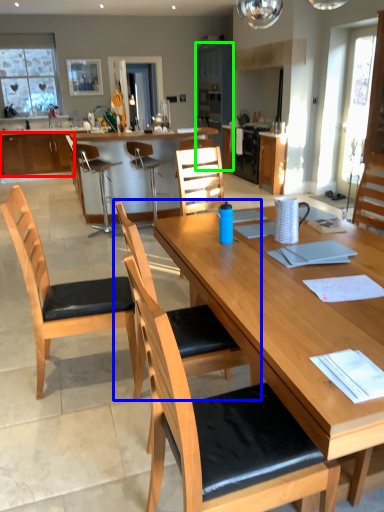
Question: Estimate the real-world distances between objects in this image. Which object is closer to cabinetry (highlighted by a red box), chair (highlighted by a blue box) or cabinetry (highlighted by a green box)?

Choices:
 (A) chair
 (B) cabinetry

Answer: (B)